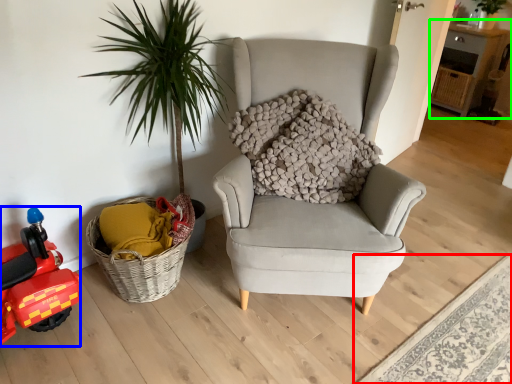
Question: Based on their relative distances, which object is farther from plain (highlighted by a red box)? Choose from toy car (highlighted by a blue box) and table (highlighted by a green box).

Choices:
 (A) toy car
 (B) table

Answer: (B)